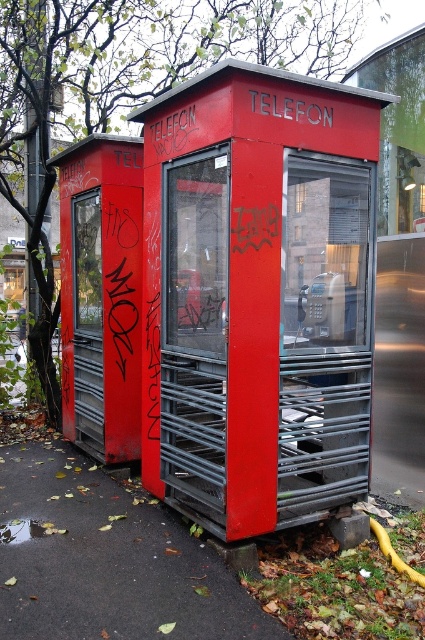
Question: Can you confirm if matte red telephone booth at center is positioned to the right of metallic gray telephone at center?

Choices:
 (A) no
 (B) yes

Answer: (A)

Question: Is matte red telephone booth at center bigger than metallic gray telephone at center?

Choices:
 (A) no
 (B) yes

Answer: (B)

Question: Does matte red telephone booth at center appear on the left side of metallic gray telephone at center?

Choices:
 (A) yes
 (B) no

Answer: (A)